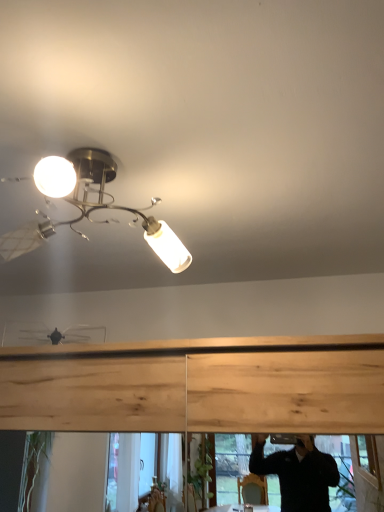
Image resolution: width=384 pixels, height=512 pixels. What do you see at coordinates (89, 206) in the screenshot?
I see `metallic brass chandelier at upper left` at bounding box center [89, 206].

This screenshot has height=512, width=384. Find the location of `metallic brass chandelier at upper left`. metallic brass chandelier at upper left is located at coordinates (89, 206).

In order to face metallic brass chandelier at upper left, should I rotate leftwards or rightwards?

Turn left approximately 15.933 degrees to face it.

Identify the location of metallic brass chandelier at upper left. Image resolution: width=384 pixels, height=512 pixels. (89, 206).